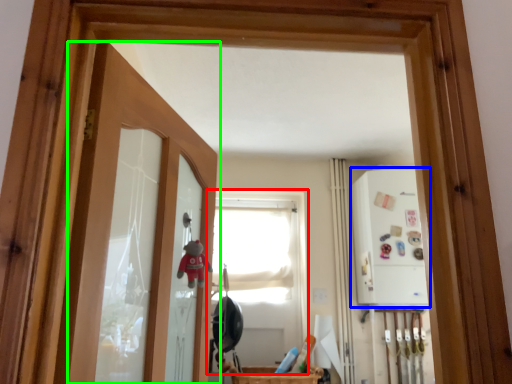
Question: Which is farther away from window (highlighted by a red box)? medicine cabinet (highlighted by a blue box) or door (highlighted by a green box)?

Choices:
 (A) medicine cabinet
 (B) door

Answer: (B)